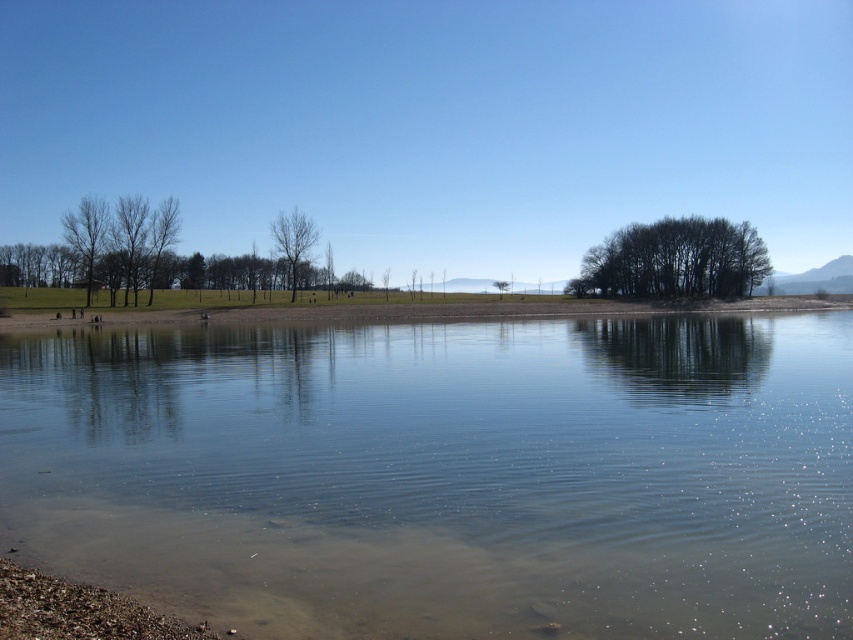
Question: Can you confirm if dark brown textured trees at center right is positioned above bare branches at left?

Choices:
 (A) no
 (B) yes

Answer: (A)

Question: Which of the following is the farthest from the observer?

Choices:
 (A) bare wood tree at center
 (B) dark brown textured trees at center right
 (C) clear water at center
 (D) brown sand at center

Answer: (B)

Question: Which point is closer to the camera?

Choices:
 (A) (628, 232)
 (B) (82, 216)

Answer: (B)

Question: Estimate the real-world distances between objects in this image. Which object is closer to the brown sand at center?

Choices:
 (A) dark brown textured trees at center right
 (B) bare branches at left
 (C) bare wood tree at center

Answer: (A)

Question: Can you confirm if brown sand at center is positioned to the right of bare branches at left?

Choices:
 (A) no
 (B) yes

Answer: (B)

Question: Is dark brown textured trees at center right positioned at the back of bare branches at left?

Choices:
 (A) yes
 (B) no

Answer: (A)